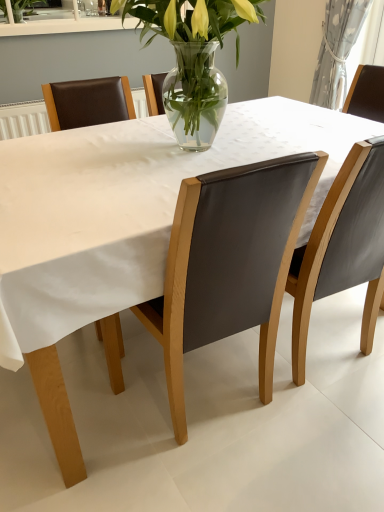
You are a GUI agent. You are given a task and a screenshot of the screen. Output one action in this format:
    pyautogui.click(x=<x>, y=<y>)
    Task: Click on the vacant space in front of leather at center, positioned as the first chair in left-to-right order
    
    Given the screenshot: What is the action you would take?
    pyautogui.click(x=224, y=481)